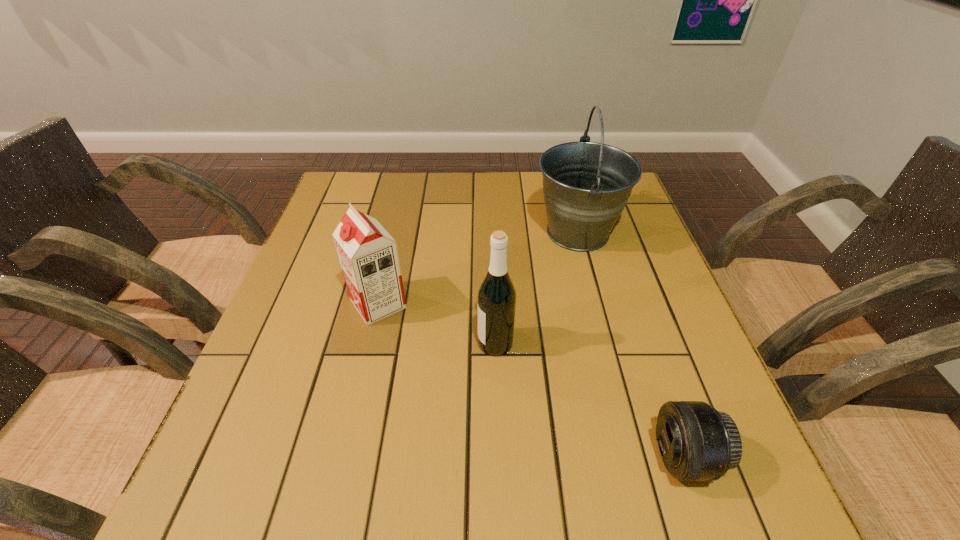
Image resolution: width=960 pixels, height=540 pixels. I want to click on object that is the closest to the third nearest object, so click(496, 298).